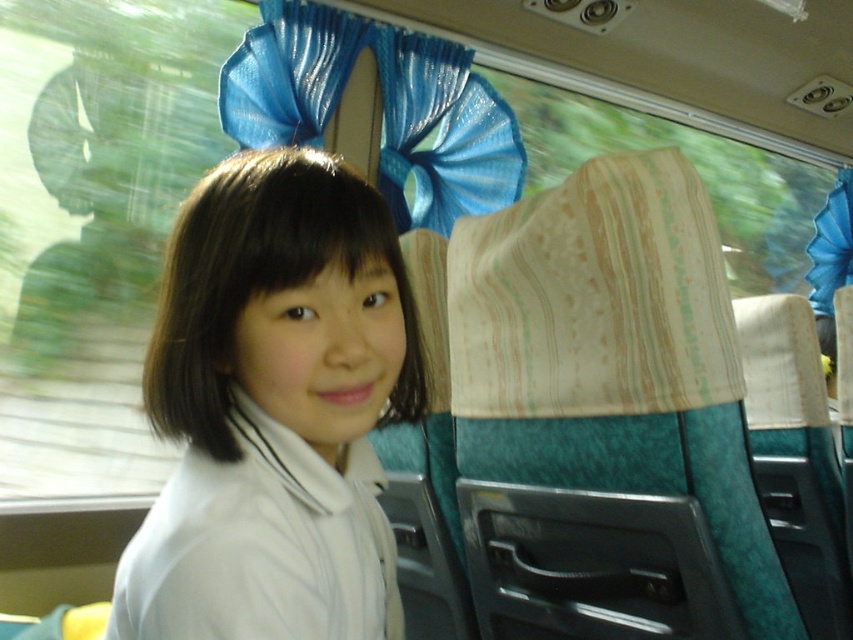
Looking at this image, who is lower down, white fabric at center or shiny blue fabric at upper center?

Positioned lower is white fabric at center.

Does white fabric at center have a lesser height compared to shiny blue fabric at upper center?

Yes.

Which is in front, point (260, 157) or point (502, 138)?

Positioned in front is point (260, 157).

Locate an element on the screen. This screenshot has height=640, width=853. white fabric at center is located at coordinates (273, 410).